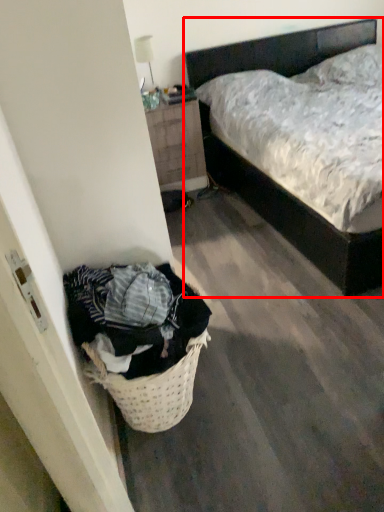
Question: From the image's perspective, where is bed (annotated by the red box) located relative to nightstand?

Choices:
 (A) below
 (B) above

Answer: (B)